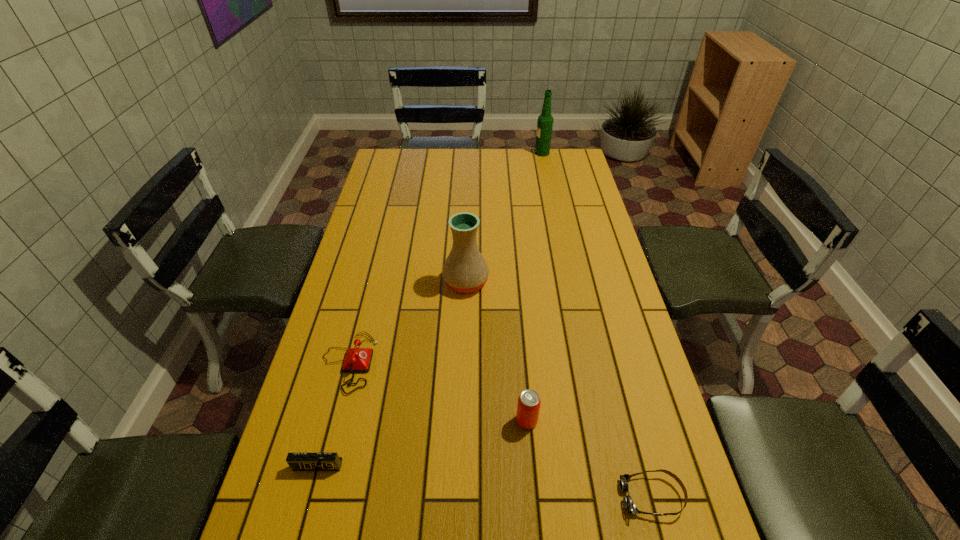
Identify the location of free space located 0.230m on the label of the tallest object. (485, 153).

Image resolution: width=960 pixels, height=540 pixels. I want to click on vacant point located on the label of the tallest object, so click(x=447, y=153).

I want to click on vacant space located on the label of the tallest object, so click(521, 153).

The width and height of the screenshot is (960, 540). Find the location of `blank space located 0.310m on the right of the pottery`. blank space located 0.310m on the right of the pottery is located at coordinates (586, 282).

Where is `free spot located on the right of the fourth farthest object`? The image size is (960, 540). free spot located on the right of the fourth farthest object is located at coordinates (587, 421).

Find the location of a particular element. free location located 0.150m on the dial of the third farthest object is located at coordinates pyautogui.click(x=430, y=362).

Find the location of `vacant region located 0.090m on the front-facing side of the fifth farthest object`. vacant region located 0.090m on the front-facing side of the fifth farthest object is located at coordinates (304, 515).

Find the location of `vacant space positioned 0.170m on the front-facing side of the nearest object`. vacant space positioned 0.170m on the front-facing side of the nearest object is located at coordinates (542, 496).

Find the location of `vacant space located on the front-facing side of the nearest object`. vacant space located on the front-facing side of the nearest object is located at coordinates (478, 496).

Where is `free space located 0.290m on the front-facing side of the nearest object`? This screenshot has width=960, height=540. free space located 0.290m on the front-facing side of the nearest object is located at coordinates (487, 496).